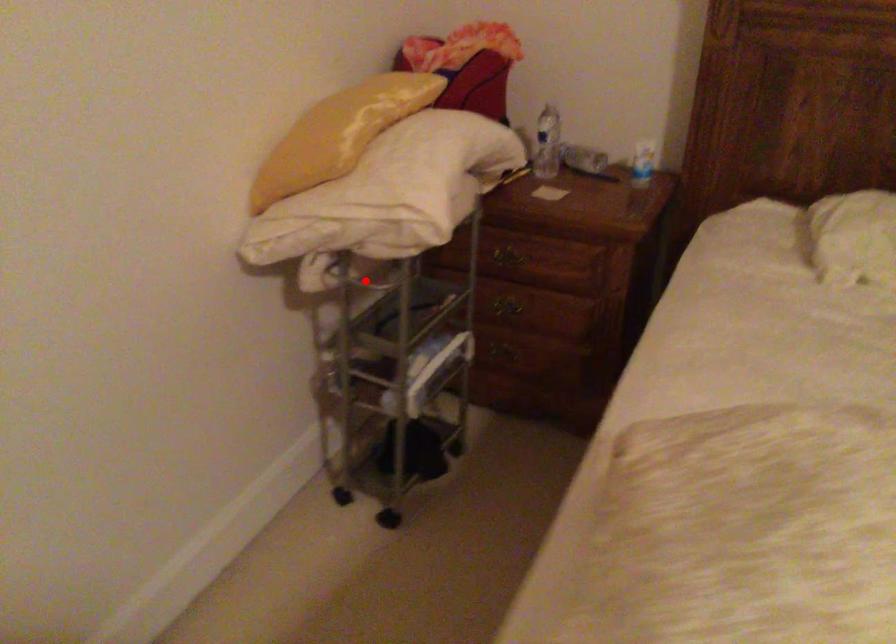
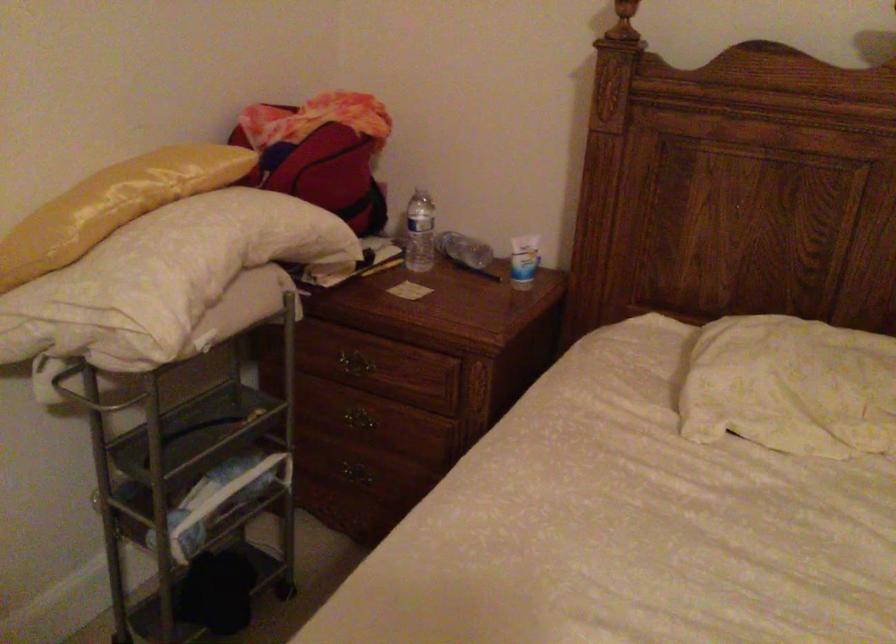
Question: I am providing you with two images of the same scene from different viewpoints. Given a red point in image1, look at the same physical point in image2. Is it:

Choices:
 (A) Closer to the viewpoint
 (B) Farther from the viewpoint

Answer: (A)